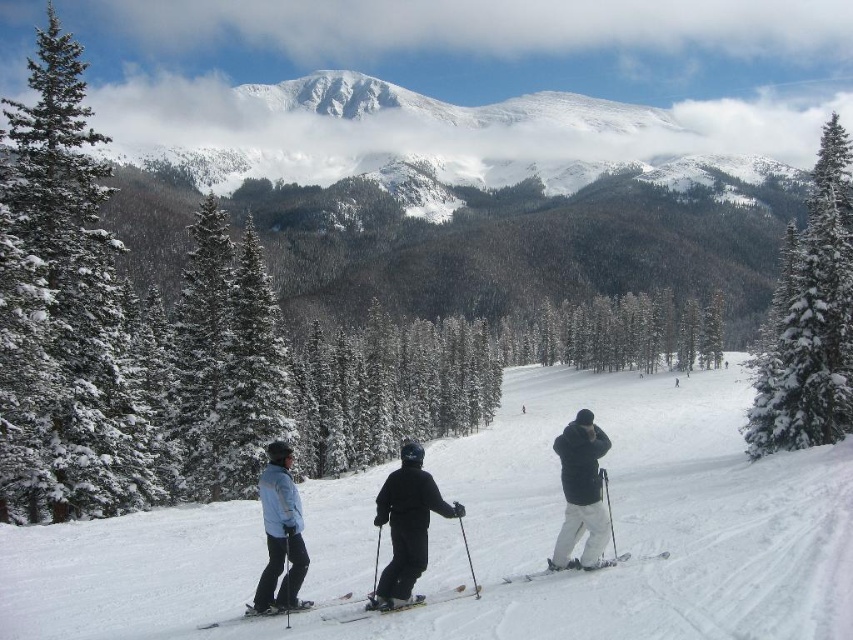
Is white snow ski slope at center to the left of black matte ski at center from the viewer's perspective?

No, white snow ski slope at center is not to the left of black matte ski at center.

Is white snow ski slope at center above black matte ski at center?

Actually, white snow ski slope at center is below black matte ski at center.

Identify the location of white snow ski slope at center. The height and width of the screenshot is (640, 853). (506, 536).

Locate an element on the screen. white snow ski slope at center is located at coordinates (506, 536).

Can you confirm if black matte ski at center is bigger than black matte ski at lower center?

Actually, black matte ski at center might be smaller than black matte ski at lower center.

Is point (415, 598) closer to viewer compared to point (251, 611)?

No.

Identify the location of black matte ski at center. This screenshot has height=640, width=853. (399, 604).

Is point (282, 456) more distant than point (592, 570)?

Yes, point (282, 456) is farther from viewer.

Does light blue jacket at center have a lesser width compared to white matte ski at center?

Incorrect, light blue jacket at center's width is not less than white matte ski at center's.

Is point (289, 499) positioned behind point (625, 557)?

That is False.

This screenshot has width=853, height=640. Identify the location of light blue jacket at center. (280, 532).